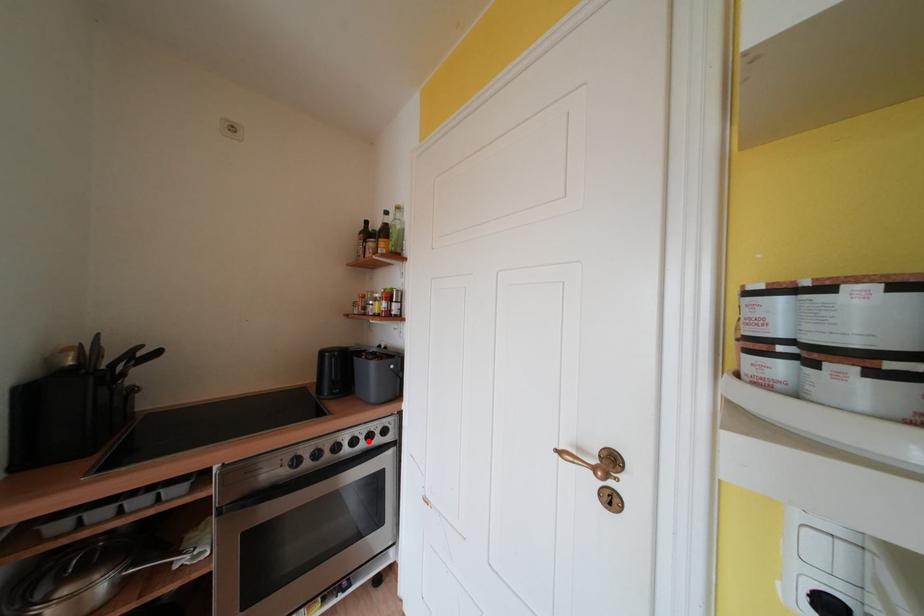
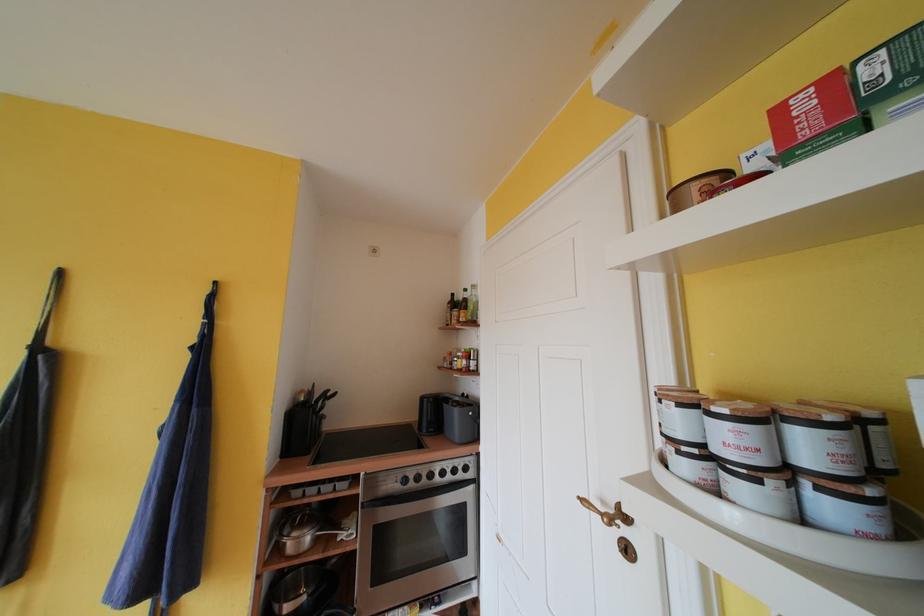
Where in the second image is the point corresponding to the highlighted location from the first image?

(455, 474)